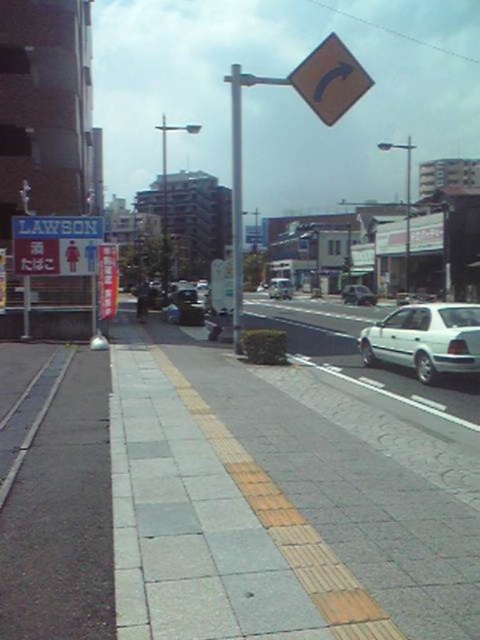
Question: Considering the real-world distances, which object is farthest from the silver metallic car at center?

Choices:
 (A) yellow matte traffic sign at upper center
 (B) metallic silver car at center

Answer: (A)

Question: Which point is farther to the camera?

Choices:
 (A) white glossy sedan at right
 (B) metallic silver car at center
 (C) yellow matte traffic sign at upper center
 (D) concrete pavement at lower left

Answer: (B)

Question: Does yellow brick pavement at center lie behind concrete pavement at lower left?

Choices:
 (A) no
 (B) yes

Answer: (A)

Question: Which is farther from the silver metallic car at center?

Choices:
 (A) yellow matte traffic sign at upper center
 (B) white glossy sedan at right

Answer: (B)

Question: Observing the image, what is the correct spatial positioning of concrete pavement at lower left in reference to silver metallic car at center?

Choices:
 (A) above
 (B) below

Answer: (B)

Question: Can you confirm if metallic silver car at center is positioned below silver metallic car at center?

Choices:
 (A) yes
 (B) no

Answer: (A)